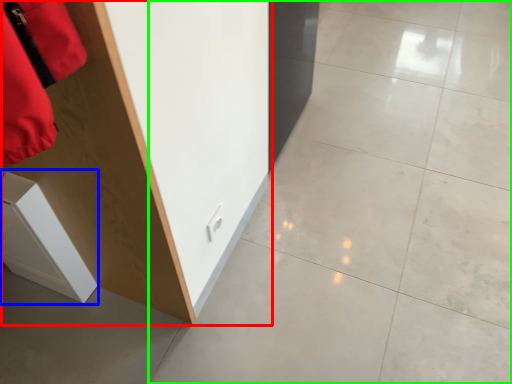
Question: Based on their relative distances, which object is farther from furniture (highlighted by a red box)? Choose from cabinetry (highlighted by a blue box) and concrete (highlighted by a green box).

Choices:
 (A) cabinetry
 (B) concrete

Answer: (B)